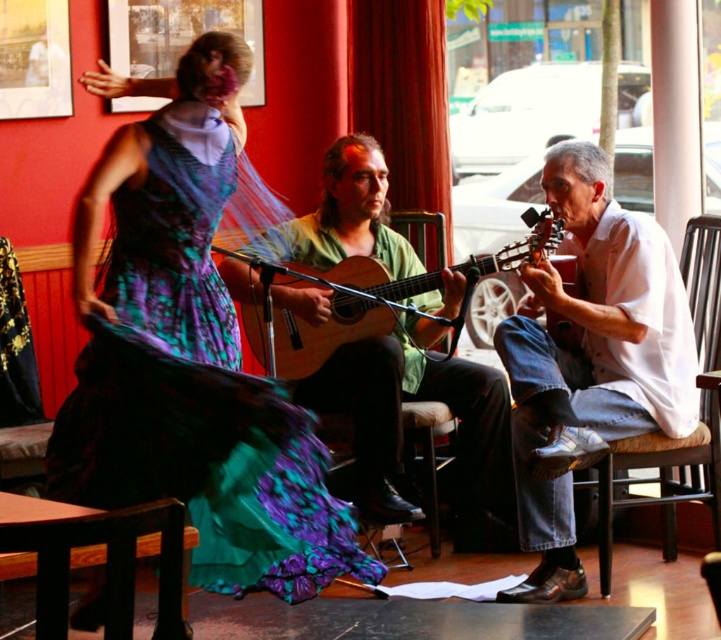
The height and width of the screenshot is (640, 721). In order to click on matte green and purple fabric dress at center in this screenshot , I will do `click(195, 397)`.

Can you confirm if matte green and purple fabric dress at center is shorter than white cotton shirt at right?

Correct, matte green and purple fabric dress at center is not as tall as white cotton shirt at right.

Is point (260, 422) behind point (658, 262)?

No, (260, 422) is in front of (658, 262).

Identify the location of matte green and purple fabric dress at center. (195, 397).

The width and height of the screenshot is (721, 640). In order to click on white cotton shirt at right in this screenshot , I will do 590,358.

Can you confirm if white cotton shirt at right is smaller than wooden acoustic guitar at center?

Actually, white cotton shirt at right might be larger than wooden acoustic guitar at center.

The image size is (721, 640). What do you see at coordinates (590, 358) in the screenshot? I see `white cotton shirt at right` at bounding box center [590, 358].

Identify the location of white cotton shirt at right. (590, 358).

Does matte green and purple fabric dress at center appear over brown wooden chair at right?

Correct, matte green and purple fabric dress at center is located above brown wooden chair at right.

Who is higher up, matte green and purple fabric dress at center or brown wooden chair at right?

Positioned higher is matte green and purple fabric dress at center.

Is point (169, 129) farther from viewer compared to point (703, 460)?

No, (169, 129) is in front of (703, 460).

Identify the location of matte green and purple fabric dress at center. This screenshot has width=721, height=640. (195, 397).